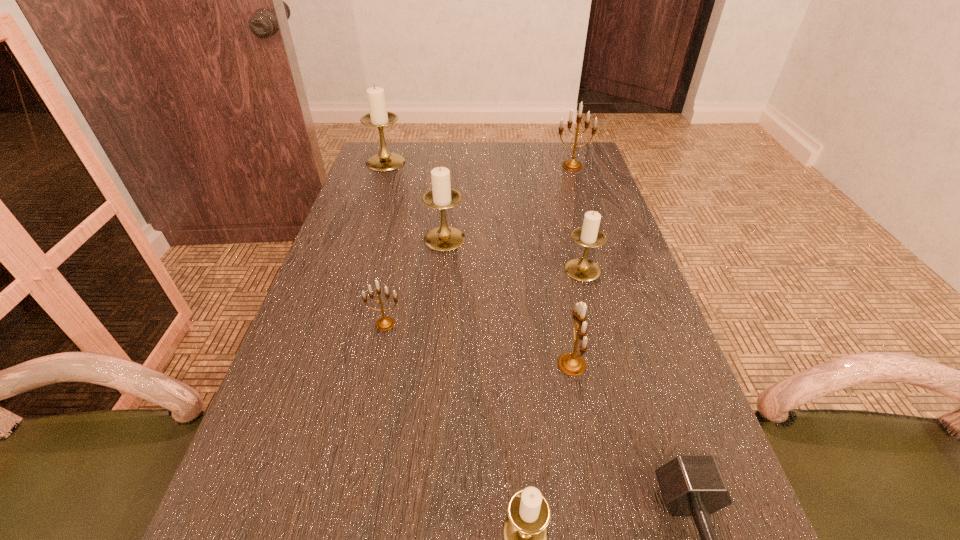
The height and width of the screenshot is (540, 960). I want to click on the leftmost white candle holder, so pos(379,117).

Find the location of a particular element. The image size is (960, 540). the leftmost object is located at coordinates (379, 117).

This screenshot has width=960, height=540. I want to click on the biggest gold candelabrum, so click(x=572, y=165).

The height and width of the screenshot is (540, 960). Identify the location of the rightmost gold candelabrum. (572, 165).

Identify the location of the fifth nearest candle holder. (444, 238).

Image resolution: width=960 pixels, height=540 pixels. I want to click on the third nearest white candle holder, so click(444, 238).

Identify the location of the nearest gold candelabrum. (572, 364).

Locate an element on the screen. Image resolution: width=960 pixels, height=540 pixels. the sixth farthest object is located at coordinates (572, 364).

Locate an element on the screen. This screenshot has height=540, width=960. the fourth farthest object is located at coordinates point(582,269).

Where is `the second nearest white candle holder`? This screenshot has height=540, width=960. the second nearest white candle holder is located at coordinates (582, 269).